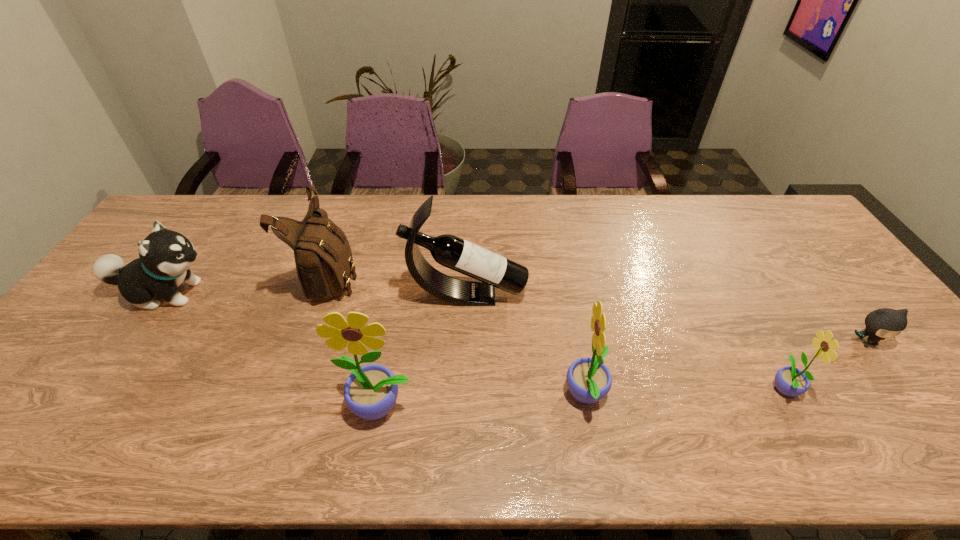
This screenshot has width=960, height=540. I want to click on free space located 0.050m on the front-facing side of the second sunflower from right to left, so click(x=542, y=396).

Where is `vacant space located 0.400m on the front-facing side of the second sunflower from right to left`? vacant space located 0.400m on the front-facing side of the second sunflower from right to left is located at coordinates 394,396.

Image resolution: width=960 pixels, height=540 pixels. In order to click on free space located on the front-facing side of the second sunflower from right to left in this screenshot , I will do `click(437, 396)`.

At what (x,y) coordinates should I click in order to perform the action: click on free space located on the front-facing side of the shortest sunflower. Please return your answer as a coordinate pair (x, y). Looking at the image, I should click on (927, 387).

Identify the location of vacant region located 0.350m at the face of the puppy. (340, 293).

Locate an element on the screen. The width and height of the screenshot is (960, 540). free space located 0.270m on the front-facing side of the shoulder bag is located at coordinates (448, 275).

Identify the location of vacant point located on the front-facing side of the rightmost object. (910, 399).

Find the location of a particular element. The width and height of the screenshot is (960, 540). free space located on the stand of the wine bottle is located at coordinates pos(544,295).

I want to click on object that is at the left edge, so click(165, 256).

Where is `object that is at the right edge`? This screenshot has width=960, height=540. object that is at the right edge is located at coordinates (882, 323).